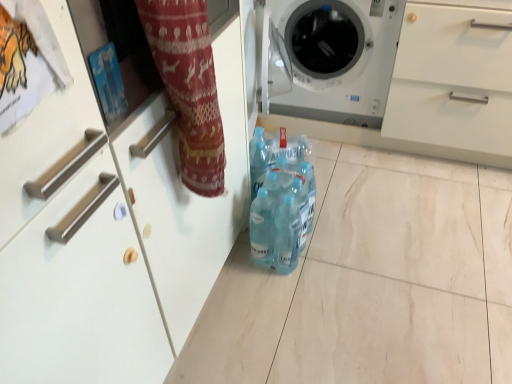
Question: Should I look upward or downward to see blue plastic bottles at center?

Choices:
 (A) up
 (B) down

Answer: (B)

Question: Is white glossy washing machine at center smaller than blue plastic bottles at center?

Choices:
 (A) yes
 (B) no

Answer: (B)

Question: Is white glossy washing machine at center further to camera compared to blue plastic bottles at center?

Choices:
 (A) yes
 (B) no

Answer: (A)

Question: Would you say white glossy washing machine at center is a long distance from blue plastic bottles at center?

Choices:
 (A) yes
 (B) no

Answer: (B)

Question: Does white glossy washing machine at center appear on the left side of blue plastic bottles at center?

Choices:
 (A) no
 (B) yes

Answer: (A)

Question: Is white glossy washing machine at center facing away from blue plastic bottles at center?

Choices:
 (A) no
 (B) yes

Answer: (A)

Question: Does white glossy washing machine at center touch blue plastic bottles at center?

Choices:
 (A) no
 (B) yes

Answer: (A)

Question: Does blue plastic bottles at center have a greater width compared to white glossy washing machine at center?

Choices:
 (A) no
 (B) yes

Answer: (A)

Question: Could you tell me if blue plastic bottles at center is facing white glossy washing machine at center?

Choices:
 (A) yes
 (B) no

Answer: (B)

Question: Can you confirm if blue plastic bottles at center is positioned to the left of white glossy washing machine at center?

Choices:
 (A) no
 (B) yes

Answer: (B)

Question: Is white glossy washing machine at center at the back of blue plastic bottles at center?

Choices:
 (A) yes
 (B) no

Answer: (B)

Question: Can you confirm if blue plastic bottles at center is taller than white glossy washing machine at center?

Choices:
 (A) yes
 (B) no

Answer: (B)

Question: Is blue plastic bottles at center bigger than white glossy washing machine at center?

Choices:
 (A) no
 (B) yes

Answer: (A)

Question: Is point (346, 94) closer or farther from the camera than point (257, 218)?

Choices:
 (A) farther
 (B) closer

Answer: (A)